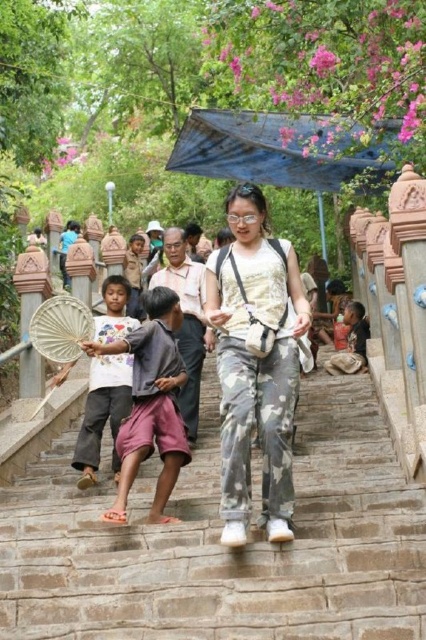
Between point (5, 620) and point (227, 536), which one is positioned behind?

Point (227, 536)

From the picture: Does stone stairs at center have a larger size compared to camo pants at center?

Indeed, stone stairs at center has a larger size compared to camo pants at center.

At what (x,y) coordinates should I click in order to perform the action: click on stone stairs at center. Please return your answer as a coordinate pair (x, y). This screenshot has width=426, height=640. Looking at the image, I should click on (222, 547).

At what (x,y) coordinates should I click in order to perform the action: click on stone stairs at center. Please return your answer as a coordinate pair (x, y). This screenshot has height=640, width=426. Looking at the image, I should click on (222, 547).

Between stone stairs at center and brown cotton shirt at lower right, which one is positioned higher?

brown cotton shirt at lower right

Does point (371, 438) lie in front of point (353, 352)?

Yes, point (371, 438) is closer to viewer.

The width and height of the screenshot is (426, 640). What are the coordinates of `stone stairs at center` in the screenshot? It's located at tap(222, 547).

Which is behind, point (141, 426) or point (367, 320)?

Point (367, 320)

Does point (163, 413) come behind point (362, 307)?

No, (163, 413) is in front of (362, 307).

Is point (111, 516) closer to viewer compared to point (359, 305)?

That is True.

The height and width of the screenshot is (640, 426). I want to click on pink cotton shorts at lower center, so click(150, 403).